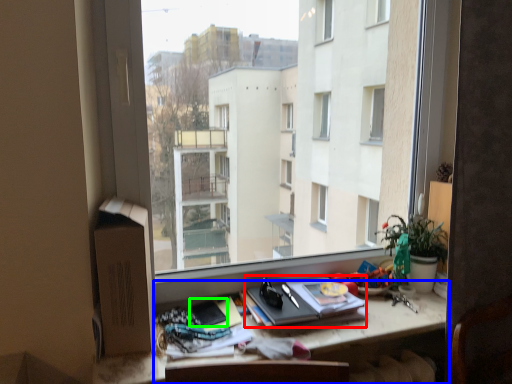
Question: Which is nearer to the paperback book (highlighted by a red box)? desk (highlighted by a blue box) or paperback book (highlighted by a green box).

Choices:
 (A) desk
 (B) paperback book

Answer: (A)